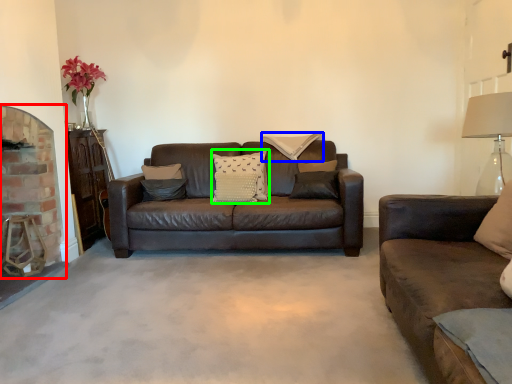
Question: Which is nearer to the fireplace (highlighted by a red box)? pillow (highlighted by a blue box) or pillow (highlighted by a green box).

Choices:
 (A) pillow
 (B) pillow

Answer: (B)